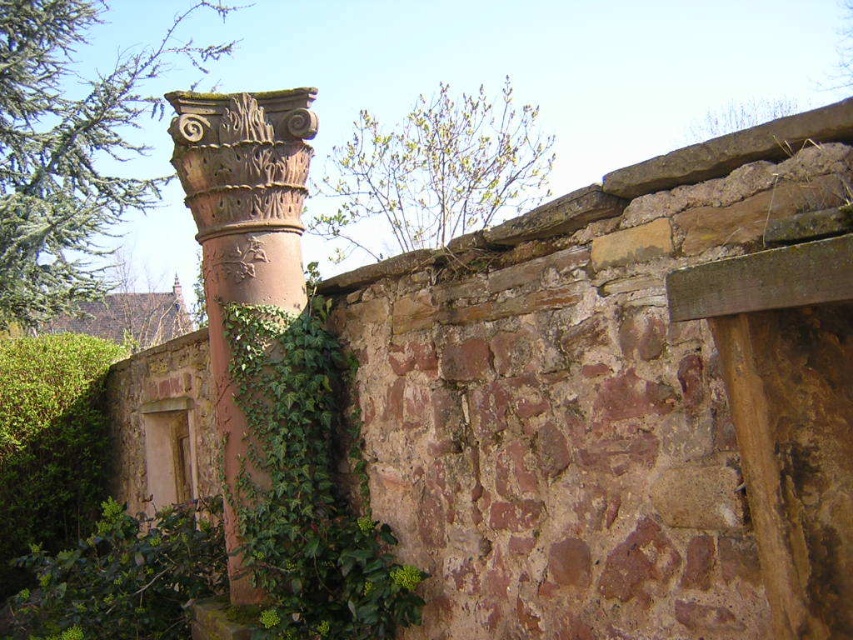
Who is positioned more to the right, rusty terracotta column at center-left or green leafy tree at upper center?

From the viewer's perspective, green leafy tree at upper center appears more on the right side.

Can you confirm if rusty terracotta column at center-left is positioned to the right of green leafy tree at upper center?

In fact, rusty terracotta column at center-left is to the left of green leafy tree at upper center.

Between point (296, 301) and point (413, 172), which one is positioned behind?

The point (413, 172) is behind.

I want to click on rusty terracotta column at center-left, so click(242, 236).

Can you confirm if green leafy tree at upper left is shorter than green leafy tree at upper center?

No, green leafy tree at upper left is not shorter than green leafy tree at upper center.

Image resolution: width=853 pixels, height=640 pixels. Identify the location of green leafy tree at upper left. (71, 148).

Between point (35, 307) and point (265, 282), which one is positioned behind?

Positioned behind is point (35, 307).

Who is more forward, (86, 298) or (294, 113)?

Point (294, 113) is in front.

Who is more forward, (16, 122) or (212, 145)?

Positioned in front is point (212, 145).

This screenshot has height=640, width=853. In order to click on green leafy tree at upper left in this screenshot , I will do `click(71, 148)`.